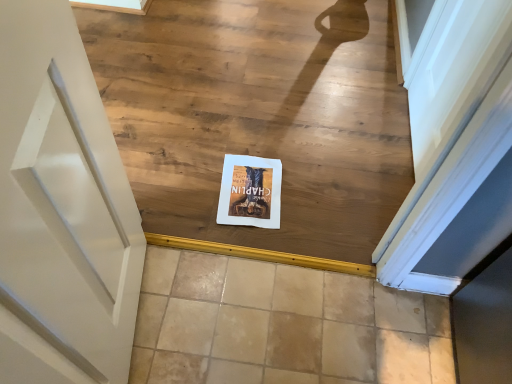
Where is `vacant point above matte paper postcard at center (from a real-world perspective)`? The width and height of the screenshot is (512, 384). vacant point above matte paper postcard at center (from a real-world perspective) is located at coordinates (251, 186).